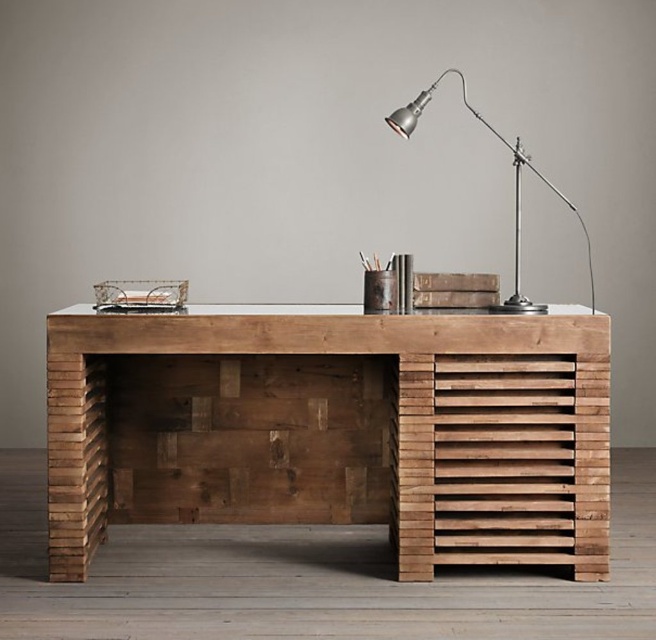
Based on the photo, is natural wood desk at center behind metallic silver desk lamp at upper right?

Yes, it is behind metallic silver desk lamp at upper right.

Between point (453, 394) and point (518, 260), which one is positioned behind?

Point (518, 260)

Identify the location of natural wood desk at center. (308, 422).